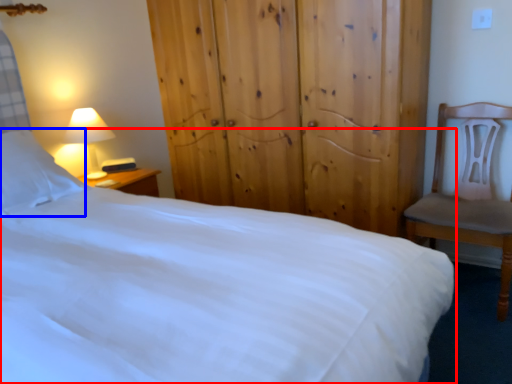
Question: Which object is further to the camera taking this photo, bed (highlighted by a red box) or pillow (highlighted by a blue box)?

Choices:
 (A) bed
 (B) pillow

Answer: (B)